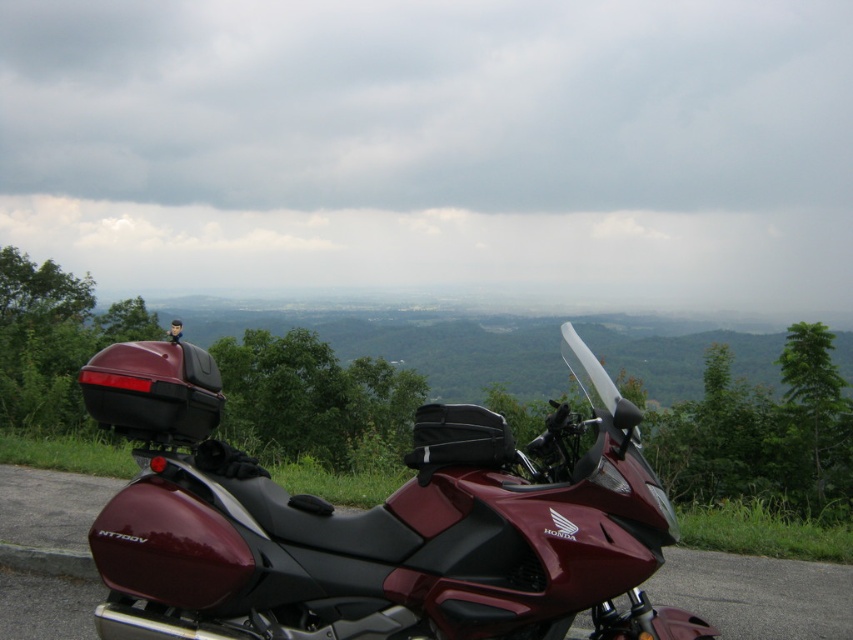
Question: Which object appears farthest from the camera in this image?

Choices:
 (A) glossy maroon motorcycle at center
 (B) maroon matte motorcycle at center

Answer: (A)

Question: In this image, where is maroon matte motorcycle at center located relative to glossy maroon motorcycle at center?

Choices:
 (A) above
 (B) below

Answer: (A)

Question: Which object is closer to the camera taking this photo?

Choices:
 (A) glossy maroon motorcycle at center
 (B) maroon matte motorcycle at center

Answer: (B)

Question: Which of the following is the closest to the observer?

Choices:
 (A) 65,490
 (B) 223,600

Answer: (B)

Question: Does maroon matte motorcycle at center appear under glossy maroon motorcycle at center?

Choices:
 (A) yes
 (B) no

Answer: (B)

Question: Can you confirm if maroon matte motorcycle at center is bigger than glossy maroon motorcycle at center?

Choices:
 (A) yes
 (B) no

Answer: (A)